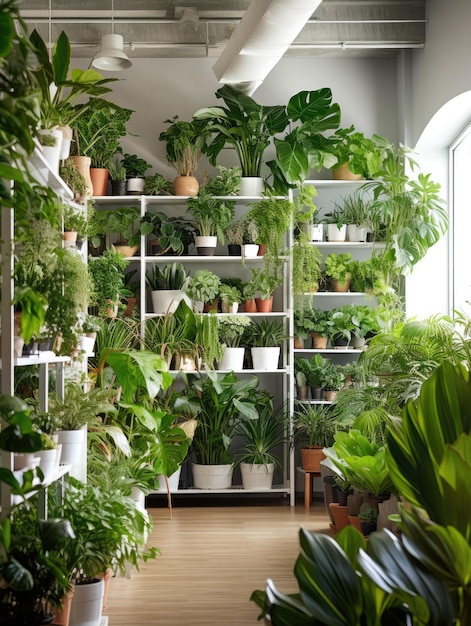
I want to click on right side of red clay pot, so click(x=63, y=612).